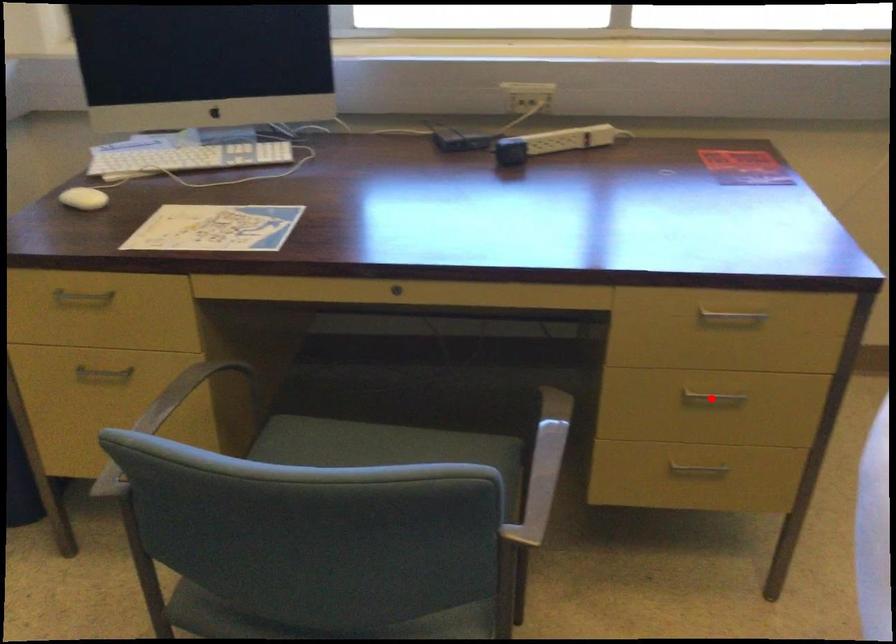
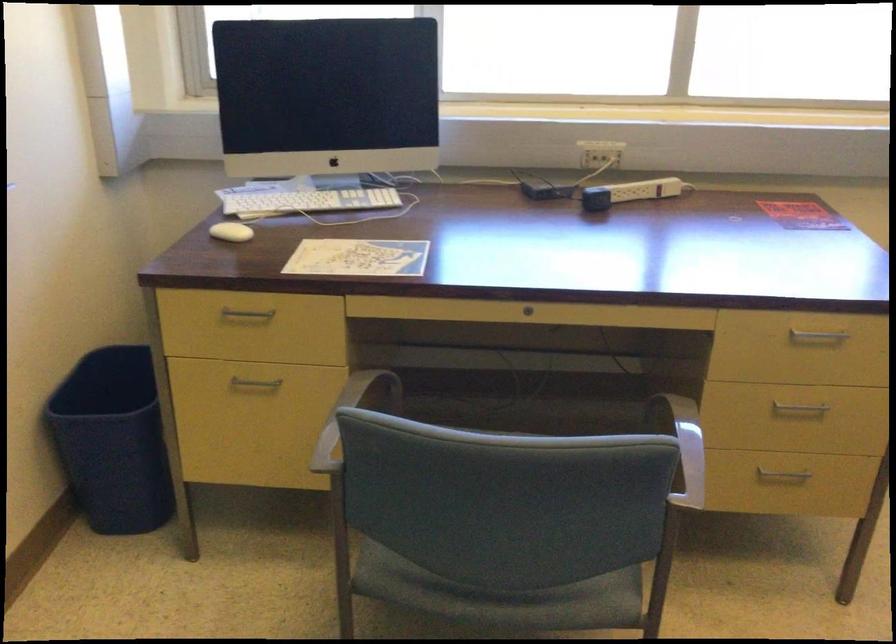
Locate, in the second image, the point that corresponds to the highlighted location in the first image.

(798, 408)